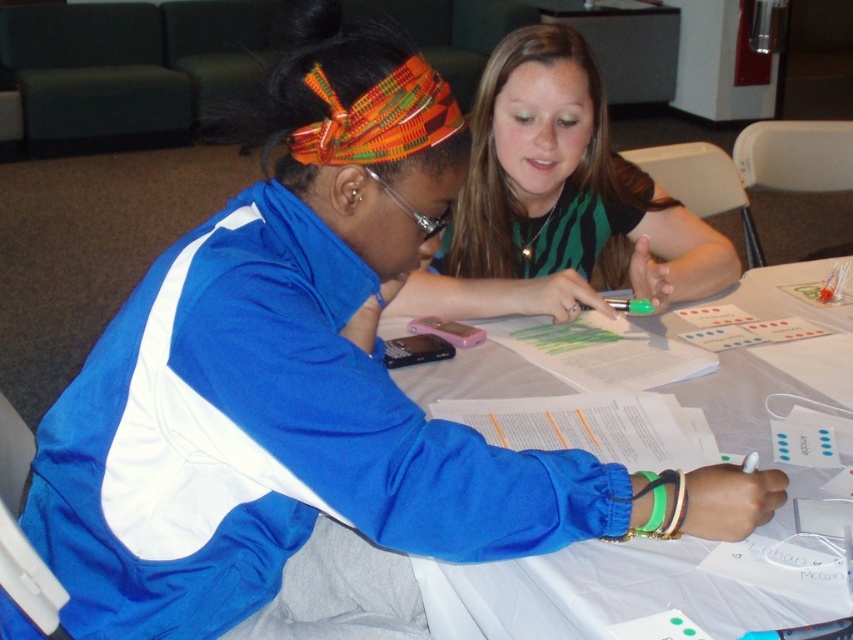
Can you confirm if green striped shirt at upper center is taller than white paper at center?

No, green striped shirt at upper center is not taller than white paper at center.

Is point (576, 280) positioned in front of point (624, 554)?

That is False.

At what (x,y) coordinates should I click in order to perform the action: click on green striped shirt at upper center. Please return your answer as a coordinate pair (x, y). The width and height of the screenshot is (853, 640). Looking at the image, I should click on (558, 202).